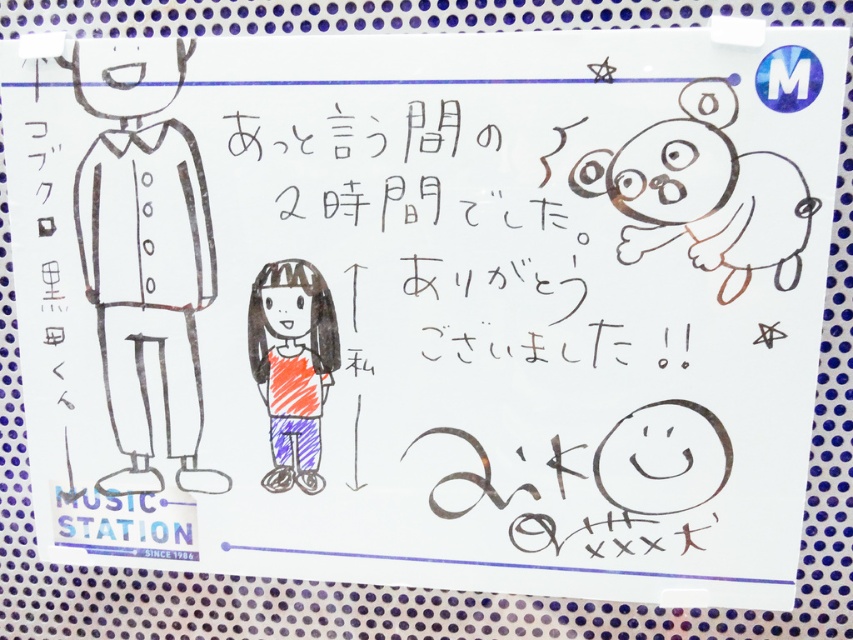
You are standing in front of the whiteboard and want to touch both the black line art figure at left and the orange crayon girl at center. Which one would you need to reach out further to touch?

The orange crayon girl at center is further away from you than the black line art figure at left, so you would need to reach out further to touch the orange crayon girl at center.

You are an art student analyzing the whiteboard drawing. You notice the black line art figure at left and the orange crayon girl at center. Which of these two figures is taller?

The black line art figure at left is taller than the orange crayon girl at center.

You are an art student who wants to draw a new character between the black line art figure at left and the orange crayon girl at center. According to the current arrangement, where should you place your new character?

The black line art figure at left is positioned on the left side of orange crayon girl at center, so you should place your new character between them, to the right of the black line art figure at left and to the left of the orange crayon girl at center.